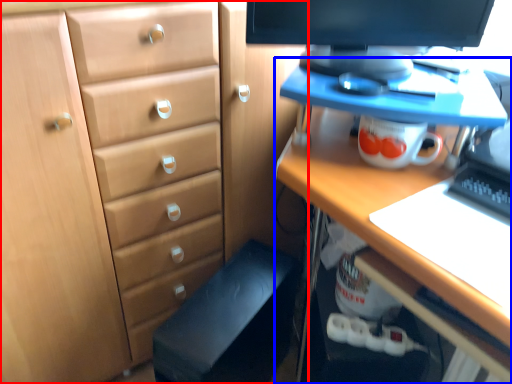
Question: Which of the following is the farthest to the observer, chest of drawers (highlighted by a red box) or desk (highlighted by a blue box)?

Choices:
 (A) chest of drawers
 (B) desk

Answer: (A)